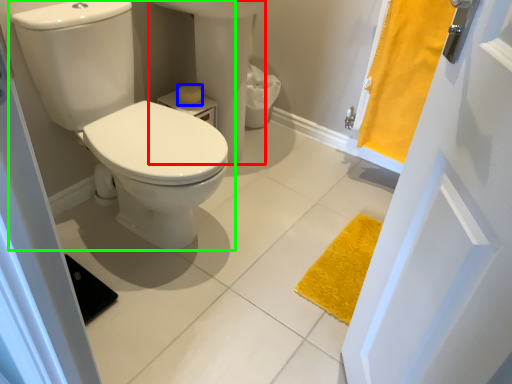
Question: Which is farther away from sink (highlighted by a red box)? toilet paper (highlighted by a blue box) or toilet (highlighted by a green box)?

Choices:
 (A) toilet paper
 (B) toilet

Answer: (B)